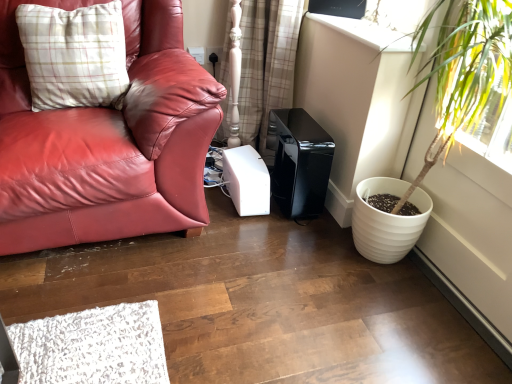
Question: From the image's perspective, is plaid fabric curtain at center located beneath plaid fabric pillow at upper left?

Choices:
 (A) no
 (B) yes

Answer: (A)

Question: Is plaid fabric pillow at upper left inside plaid fabric curtain at center?

Choices:
 (A) no
 (B) yes

Answer: (A)

Question: Is plaid fabric curtain at center looking in the opposite direction of plaid fabric pillow at upper left?

Choices:
 (A) no
 (B) yes

Answer: (A)

Question: Does plaid fabric curtain at center have a smaller size compared to plaid fabric pillow at upper left?

Choices:
 (A) no
 (B) yes

Answer: (A)

Question: Does plaid fabric curtain at center come in front of plaid fabric pillow at upper left?

Choices:
 (A) yes
 (B) no

Answer: (B)

Question: Does plaid fabric curtain at center come behind plaid fabric pillow at upper left?

Choices:
 (A) yes
 (B) no

Answer: (A)

Question: Considering the relative sizes of white textured pot at right and white glossy window sill at upper right in the image provided, is white textured pot at right wider than white glossy window sill at upper right?

Choices:
 (A) no
 (B) yes

Answer: (A)

Question: Is white textured pot at right further to camera compared to white glossy window sill at upper right?

Choices:
 (A) no
 (B) yes

Answer: (A)

Question: Is white textured pot at right outside of white glossy window sill at upper right?

Choices:
 (A) no
 (B) yes

Answer: (B)

Question: Does white textured pot at right have a larger size compared to white glossy window sill at upper right?

Choices:
 (A) no
 (B) yes

Answer: (B)

Question: Is white textured pot at right placed right next to white glossy window sill at upper right?

Choices:
 (A) yes
 (B) no

Answer: (B)

Question: Is the position of white textured pot at right less distant than that of white glossy window sill at upper right?

Choices:
 (A) yes
 (B) no

Answer: (A)

Question: From a real-world perspective, is transparent plastic window screen at upper center below plaid fabric curtain at center?

Choices:
 (A) yes
 (B) no

Answer: (B)